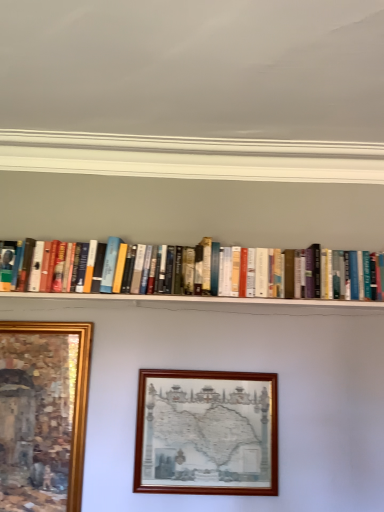
The width and height of the screenshot is (384, 512). Identify the location of free space above gold-framed painting at lower left, which is the 1th picture frame in left-to-right order (from a real-world perspective). [53, 317].